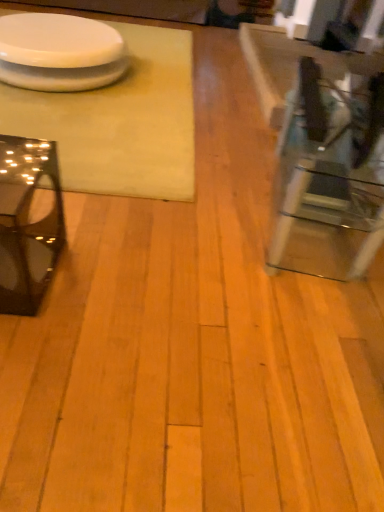
How much space does white matte table at upper left, which ranks as the third table in right-to-left order, occupy vertically?

2.06 inches.

Where is `white glossy platter at upper left`? This screenshot has height=512, width=384. white glossy platter at upper left is located at coordinates (58, 41).

Locate an element on the screen. The height and width of the screenshot is (512, 384). white matte table at upper left, acting as the first table starting from the left is located at coordinates (120, 121).

Between white glossy platter at upper left and white matte table at upper left, acting as the first table starting from the left, which one has more height?

white glossy platter at upper left.

From the image's perspective, which one is positioned lower, white glossy platter at upper left or white matte table at upper left, which ranks as the third table in right-to-left order?

From the image's view, white matte table at upper left, which ranks as the third table in right-to-left order, is below.

Is white glossy platter at upper left at the left side of white matte table at upper left, acting as the first table starting from the left?

Yes.

Between white glossy platter at upper left and white matte table at upper left, which ranks as the third table in right-to-left order, which one has larger width?

Wider between the two is white matte table at upper left, which ranks as the third table in right-to-left order.

Considering the relative sizes of clear glass table at right, which is the third table from left to right, and white matte table at upper left, which ranks as the third table in right-to-left order, in the image provided, is clear glass table at right, which is the third table from left to right, smaller than white matte table at upper left, which ranks as the third table in right-to-left order,?

Correct, clear glass table at right, which is the third table from left to right, occupies less space than white matte table at upper left, which ranks as the third table in right-to-left order.

Are clear glass table at right, the first table in the right-to-left sequence, and white matte table at upper left, acting as the first table starting from the left, making contact?

No, clear glass table at right, the first table in the right-to-left sequence, is not beside white matte table at upper left, acting as the first table starting from the left.

Is white matte table at upper left, which ranks as the third table in right-to-left order, inside clear glass table at right, the first table in the right-to-left sequence?

No, white matte table at upper left, which ranks as the third table in right-to-left order, is located outside of clear glass table at right, the first table in the right-to-left sequence.

Who is more distant, clear glass table at right, the first table in the right-to-left sequence, or white matte table at upper left, acting as the first table starting from the left?

white matte table at upper left, acting as the first table starting from the left, is further from the camera.

Are white glossy platter at upper left and clear glass table at right, the first table in the right-to-left sequence, making contact?

white glossy platter at upper left and clear glass table at right, the first table in the right-to-left sequence, are not in contact.

Consider the image. Does white glossy platter at upper left have a lesser width compared to clear glass table at right, the first table in the right-to-left sequence?

No, white glossy platter at upper left is not thinner than clear glass table at right, the first table in the right-to-left sequence.

Does glossy black glass table at left, which is the second table in right-to-left order, appear on the left side of white matte table at upper left, acting as the first table starting from the left?

In fact, glossy black glass table at left, which is the second table in right-to-left order, is to the right of white matte table at upper left, acting as the first table starting from the left.

Considering the positions of objects glossy black glass table at left, which is the second table in right-to-left order, and white matte table at upper left, acting as the first table starting from the left, in the image provided, who is in front, glossy black glass table at left, which is the second table in right-to-left order, or white matte table at upper left, acting as the first table starting from the left,?

glossy black glass table at left, which is the second table in right-to-left order, is more forward.

I want to click on table that is the 2nd one when counting backward from the glossy black glass table at left, which is the second table in right-to-left order, so click(120, 121).

From the image's perspective, does white matte table at upper left, acting as the first table starting from the left, appear lower than white glossy platter at upper left?

Correct, white matte table at upper left, acting as the first table starting from the left, appears lower than white glossy platter at upper left in the image.

Looking at this image, considering the relative sizes of white matte table at upper left, which ranks as the third table in right-to-left order, and white glossy platter at upper left in the image provided, is white matte table at upper left, which ranks as the third table in right-to-left order, shorter than white glossy platter at upper left?

Indeed, white matte table at upper left, which ranks as the third table in right-to-left order, has a lesser height compared to white glossy platter at upper left.

Is white matte table at upper left, acting as the first table starting from the left, aimed at white glossy platter at upper left?

No, white matte table at upper left, acting as the first table starting from the left, is not facing towards white glossy platter at upper left.

Between white matte table at upper left, which ranks as the third table in right-to-left order, and glossy black glass table at left, the second table from the left, which one has smaller width?

glossy black glass table at left, the second table from the left, is thinner.

Does point (111, 181) appear closer or farther from the camera than point (43, 262)?

Point (111, 181) appears to be farther away from the viewer than point (43, 262).

From the image's perspective, which one is positioned higher, white matte table at upper left, acting as the first table starting from the left, or glossy black glass table at left, which is the second table in right-to-left order?

From the image's view, white matte table at upper left, acting as the first table starting from the left, is above.

Is white matte table at upper left, which ranks as the third table in right-to-left order, directly adjacent to glossy black glass table at left, which is the second table in right-to-left order?

They are not placed beside each other.

Between clear glass table at right, which is the third table from left to right, and glossy black glass table at left, which is the second table in right-to-left order, which one has less height?

glossy black glass table at left, which is the second table in right-to-left order.

Is clear glass table at right, which is the third table from left to right, far from glossy black glass table at left, which is the second table in right-to-left order?

That's right, there is a large distance between clear glass table at right, which is the third table from left to right, and glossy black glass table at left, which is the second table in right-to-left order.

You are a GUI agent. You are given a task and a screenshot of the screen. Output one action in this format:
    pyautogui.click(x=<x>, y=<y>)
    Task: Click on the 1st table in front of the white glossy platter at upper left, counting from the anchor's position
    Image resolution: width=384 pixels, height=512 pixels.
    Given the screenshot: What is the action you would take?
    pyautogui.click(x=120, y=121)

There is a white matte table at upper left, which ranks as the third table in right-to-left order. Find the location of `the 2nd table above it (from a real-world perspective)`. the 2nd table above it (from a real-world perspective) is located at coordinates (319, 154).

From the picture: From the image, which object appears to be nearer to glossy black glass table at left, which is the second table in right-to-left order, clear glass table at right, the first table in the right-to-left sequence, or white matte table at upper left, which ranks as the third table in right-to-left order?

The object closer to glossy black glass table at left, which is the second table in right-to-left order, is white matte table at upper left, which ranks as the third table in right-to-left order.

Estimate the real-world distances between objects in this image. Which object is further from white matte table at upper left, acting as the first table starting from the left, white glossy platter at upper left or clear glass table at right, which is the third table from left to right?

Based on the image, clear glass table at right, which is the third table from left to right, appears to be further to white matte table at upper left, acting as the first table starting from the left.

From the image, which object appears to be nearer to glossy black glass table at left, which is the second table in right-to-left order, white matte table at upper left, acting as the first table starting from the left, or clear glass table at right, the first table in the right-to-left sequence?

white matte table at upper left, acting as the first table starting from the left, is positioned closer to the anchor glossy black glass table at left, which is the second table in right-to-left order.

Estimate the real-world distances between objects in this image. Which object is closer to white matte table at upper left, acting as the first table starting from the left, glossy black glass table at left, the second table from the left, or clear glass table at right, the first table in the right-to-left sequence?

glossy black glass table at left, the second table from the left, lies closer to white matte table at upper left, acting as the first table starting from the left, than the other object.

Based on their spatial positions, is glossy black glass table at left, which is the second table in right-to-left order, or clear glass table at right, which is the third table from left to right, further from white glossy platter at upper left?

clear glass table at right, which is the third table from left to right.

In the scene shown: Based on their spatial positions, is glossy black glass table at left, which is the second table in right-to-left order, or white matte table at upper left, which ranks as the third table in right-to-left order, further from clear glass table at right, the first table in the right-to-left sequence?

glossy black glass table at left, which is the second table in right-to-left order, lies further to clear glass table at right, the first table in the right-to-left sequence, than the other object.

When comparing their distances from glossy black glass table at left, the second table from the left, does white glossy platter at upper left or clear glass table at right, which is the third table from left to right, seem closer?

clear glass table at right, which is the third table from left to right, is closer to glossy black glass table at left, the second table from the left.

Estimate the real-world distances between objects in this image. Which object is closer to clear glass table at right, the first table in the right-to-left sequence, white glossy platter at upper left or glossy black glass table at left, which is the second table in right-to-left order?

Based on the image, glossy black glass table at left, which is the second table in right-to-left order, appears to be nearer to clear glass table at right, the first table in the right-to-left sequence.

The image size is (384, 512). I want to click on table located between white matte table at upper left, which ranks as the third table in right-to-left order, and clear glass table at right, the first table in the right-to-left sequence, in the left-right direction, so click(27, 224).